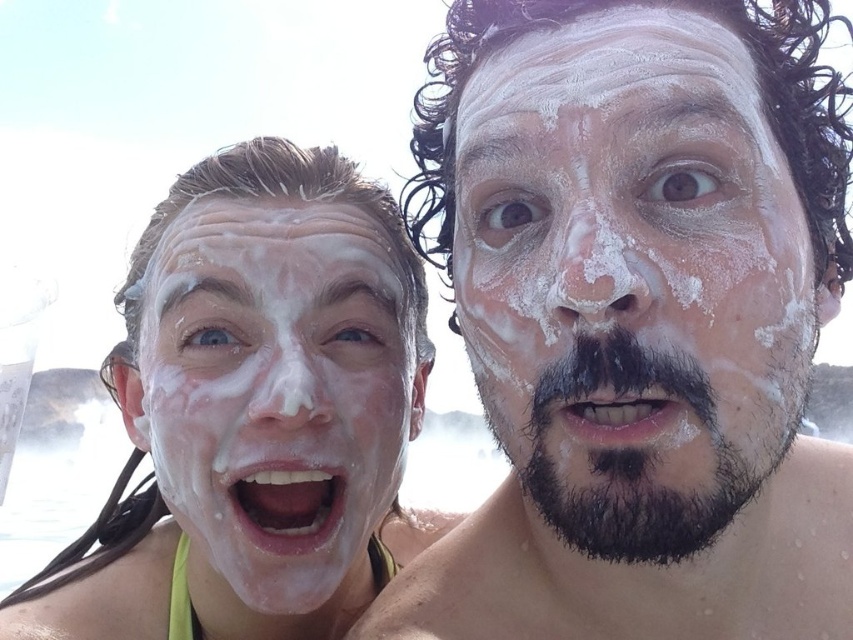
You are a photographer trying to capture a photo of both individuals in the scene. You notice two points marked in the image. The first point is at coordinates point [329,333] and the second point is at point [624,340]. To ensure both points are in focus, you need to adjust your camera settings. Which point should you focus on to ensure the other point is also in focus?

You should focus on point [624,340] because it is in front of point [329,333]. Since point [329,333] is behind point [624,340], focusing on the front point will likely keep both in focus due to the depth of field.

You are a photographer trying to capture a clear shot of the white foamy face at center and the white matte foam at left. Which object should you focus on first to ensure it appears sharp in the photo?

The white foamy face at center should be focused on first because it is in front of the white matte foam at left, ensuring it stays sharp while the background may blur slightly.

You are a photographer trying to capture the white foamy face at left. Where should you position your camera relative to the point marked at coordinates (276, 388) to ensure the subject is centered in your shot?

The point at (276, 388) marks the white foamy face at left, so you should position your camera directly facing this point to center the subject in your shot.